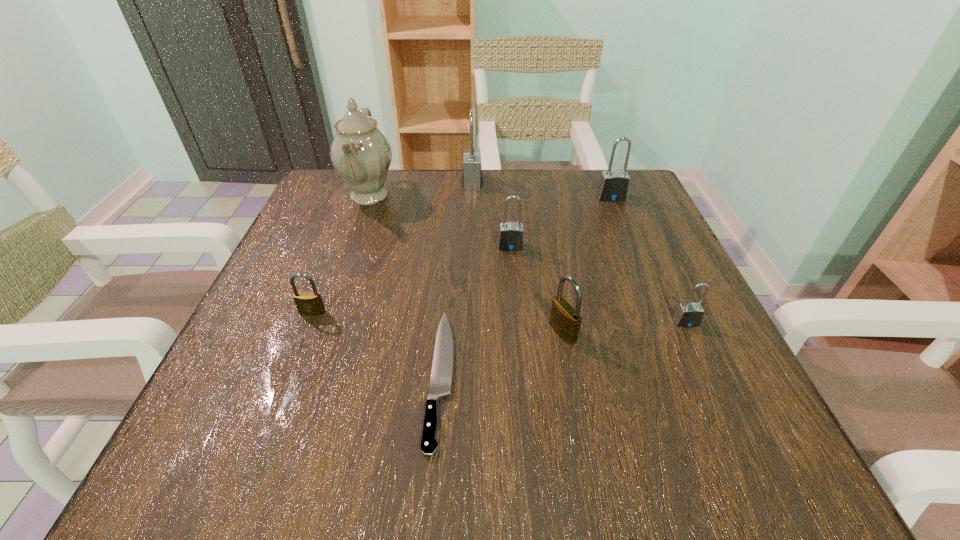
The height and width of the screenshot is (540, 960). What are the coordinates of `vacant space that satisfies the following two spatial constraints: 1. on the spout of the tallest object; 2. on the left side of the bigger brass padlock` in the screenshot? It's located at [322, 332].

The width and height of the screenshot is (960, 540). Find the location of `free space that satisfies the following two spatial constraints: 1. on the shackle of the third padlock from right to left; 2. on the left side of the biggest gray padlock`. free space that satisfies the following two spatial constraints: 1. on the shackle of the third padlock from right to left; 2. on the left side of the biggest gray padlock is located at coordinates (468, 332).

Where is `vacant space that satisfies the following two spatial constraints: 1. on the back side of the bigger brass padlock; 2. on the left side of the shortest object`? vacant space that satisfies the following two spatial constraints: 1. on the back side of the bigger brass padlock; 2. on the left side of the shortest object is located at coordinates (444, 332).